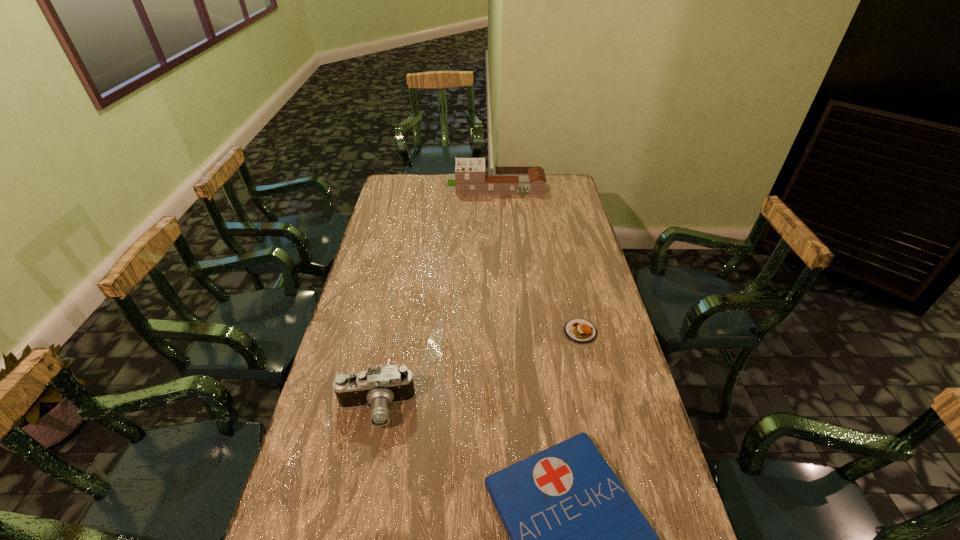
Locate an element on the screen. object that is at the far edge is located at coordinates (471, 177).

What are the coordinates of `object that is at the left edge` in the screenshot? It's located at (378, 387).

Image resolution: width=960 pixels, height=540 pixels. I want to click on dollhouse positioned at the right edge, so click(471, 177).

The width and height of the screenshot is (960, 540). I want to click on patty (food) located at the right edge, so click(581, 331).

Identify the location of object located in the far right corner section of the desktop. (471, 177).

Locate an element on the screen. This screenshot has width=960, height=540. free space at the left edge of the desktop is located at coordinates pos(379,227).

Find the location of `free point at the right edge`. free point at the right edge is located at coordinates (564, 206).

At what (x,y) coordinates should I click in order to perform the action: click on vacant space at the far right corner of the desktop. Please return your answer as a coordinate pair (x, y). The height and width of the screenshot is (540, 960). Looking at the image, I should click on (562, 192).

Image resolution: width=960 pixels, height=540 pixels. What are the coordinates of `free point between the patty (food) and the tallest object` in the screenshot? It's located at (538, 258).

This screenshot has width=960, height=540. In order to click on free space between the tallest object and the patty (food) in this screenshot , I will do `click(538, 258)`.